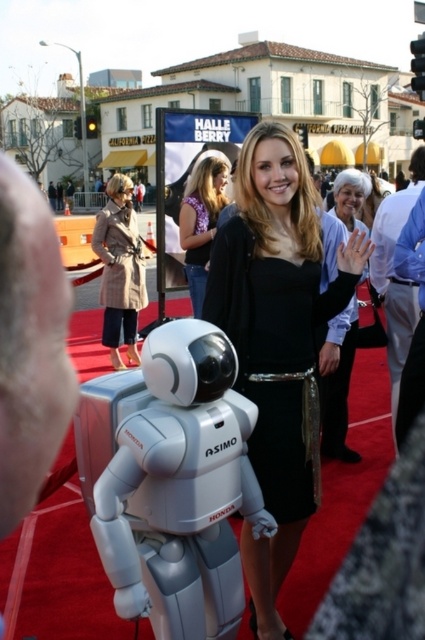
You are attending a movie premiere and see both the white matte robot at center and the purple floral blouse at center. From your perspective, which one is positioned lower?

The white matte robot at center is positioned lower than the purple floral blouse at center.

You are a photographer at the event and need to capture a photo where both the white matte robot at center and the purple floral blouse at center are clearly visible. Given their height difference, where should you position your camera to ensure both are fully in frame?

The white matte robot at center is shorter than the purple floral blouse at center, so positioning the camera at a lower angle will ensure both are fully visible. This way, the robot won t be obscured by the blouse and the blouse won t be cut off at the top.